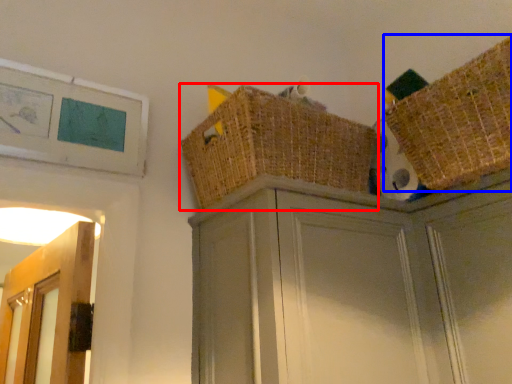
Question: Which object appears farthest to the camera in this image, basket (highlighted by a red box) or basket (highlighted by a blue box)?

Choices:
 (A) basket
 (B) basket

Answer: (A)